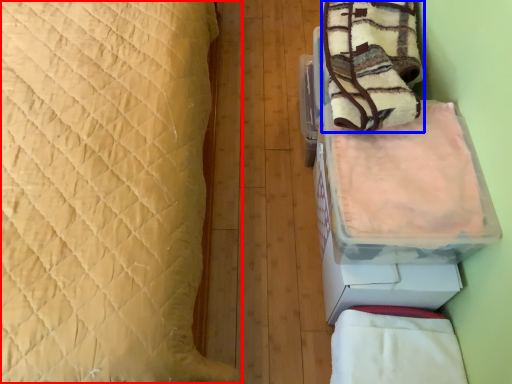
Question: Which object is further to the camera taking this photo, bed (highlighted by a red box) or blanket (highlighted by a blue box)?

Choices:
 (A) bed
 (B) blanket

Answer: (B)